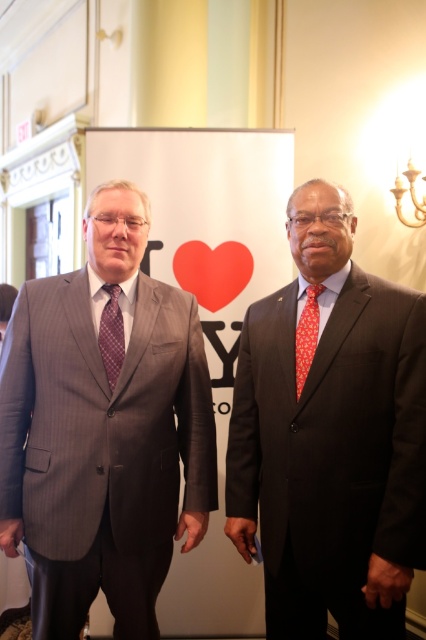
You are standing in the room and see two points marked on the floor. The first point is at position point (x=374, y=336) and the second is at point (x=120, y=333). Which point is closer to you?

Point (x=374, y=336) is in front of point (x=120, y=333), so it is closer to you.

You are a photographer taking a photo of two men in suits. You need to adjust your camera focus to ensure both the dark gray suit at right and the plaid silk tie at left are clearly visible. Based on their positions, which object is closer to the right side of the frame?

The dark gray suit at right is to the right of the plaid silk tie at left, so the dark gray suit at right is closer to the right side of the frame.

You are a photographer standing 2 meters away from the scene. You want to take a photo of the dark gray suit at right. Can you get a clear shot of it without including the banner behind them?

The dark gray suit at right is 1.70 meters from the camera, so if you are standing 2 meters away, there is a distance of 0.30 meters between you and the suit. This means you can adjust your angle or zoom to capture the dark gray suit at right without including the banner behind them.